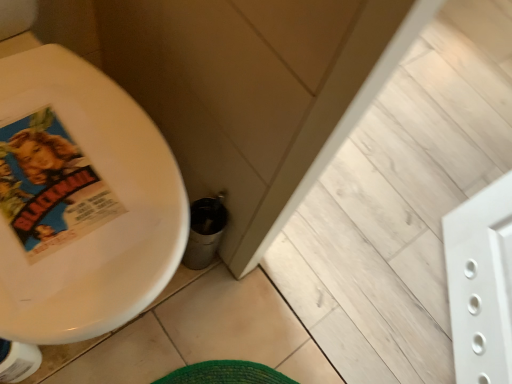
In order to face wooden floor at lower right, should I rotate leftwards or rightwards?

You should look right and rotate roughly 26.564 degrees.

Locate an element on the screen. wooden floor at lower right is located at coordinates (401, 203).

Image resolution: width=512 pixels, height=384 pixels. What do you see at coordinates (401, 203) in the screenshot? I see `wooden floor at lower right` at bounding box center [401, 203].

Where is `wooden floor at lower right`? Image resolution: width=512 pixels, height=384 pixels. wooden floor at lower right is located at coordinates (401, 203).